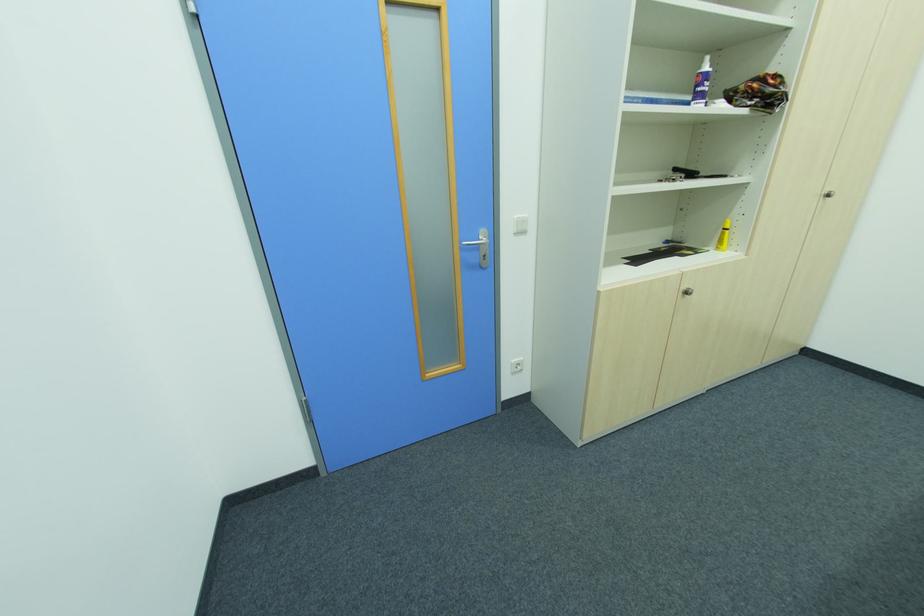
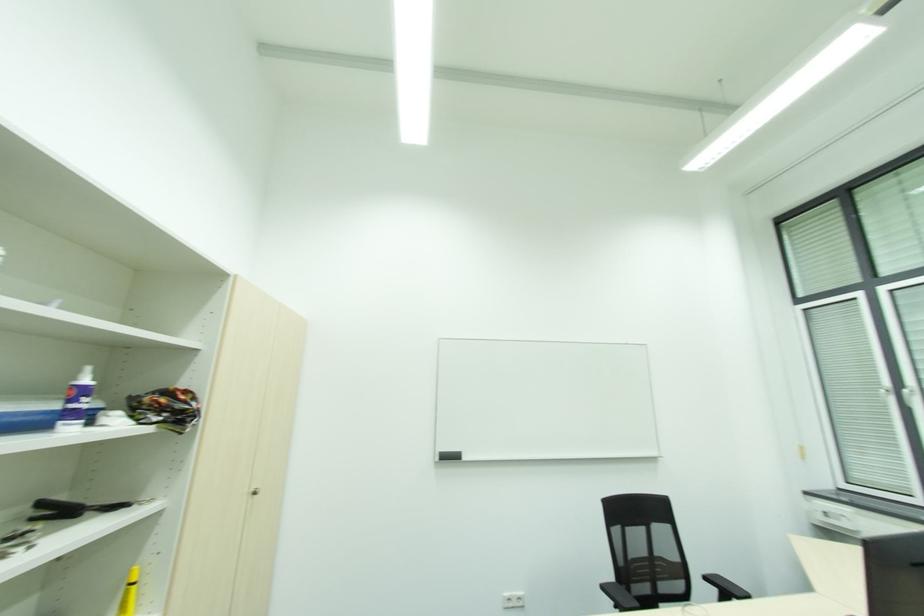
Based on the continuous images, in which direction is the camera rotating?

The camera rotated toward right-up.